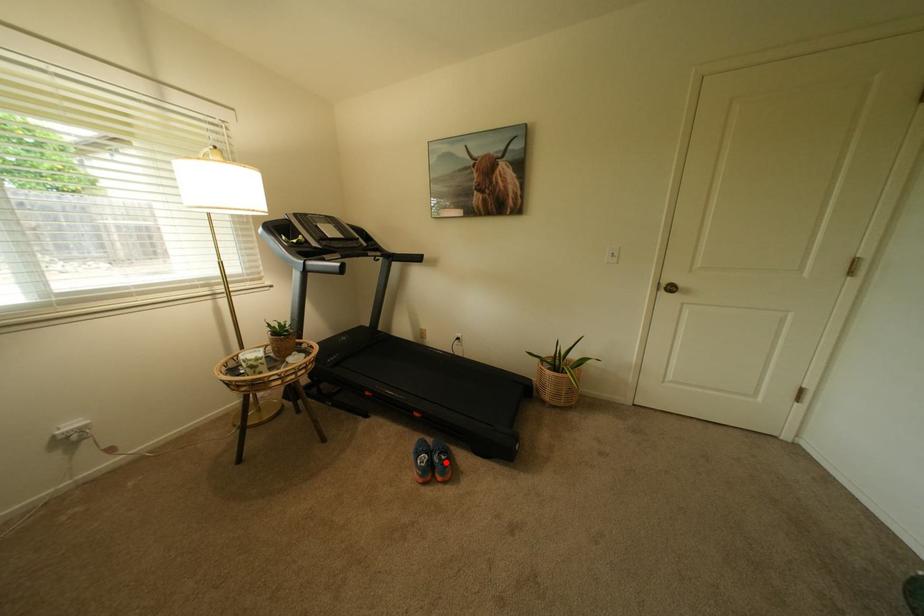
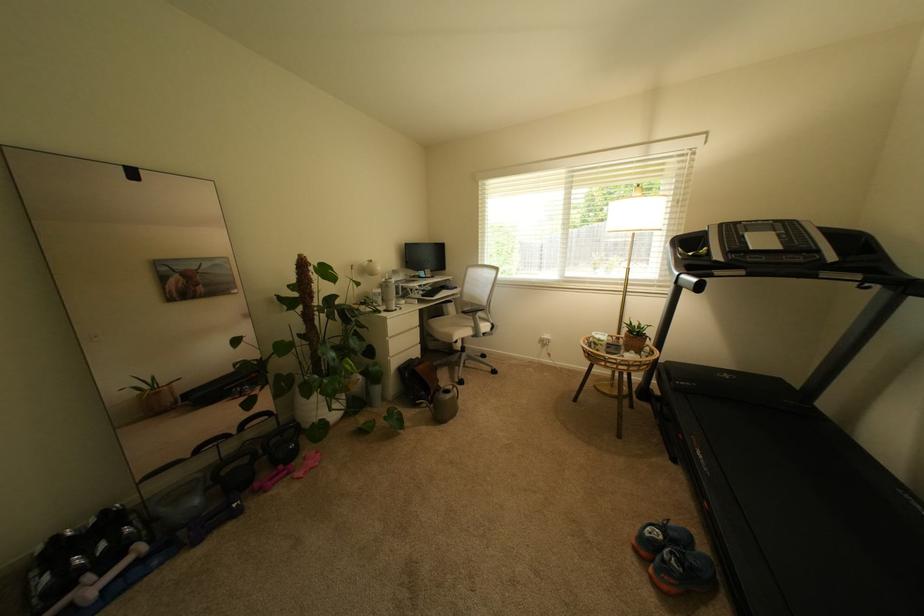
Locate, in the second image, the point that corresponds to the highlighted location in the first image.

(674, 557)